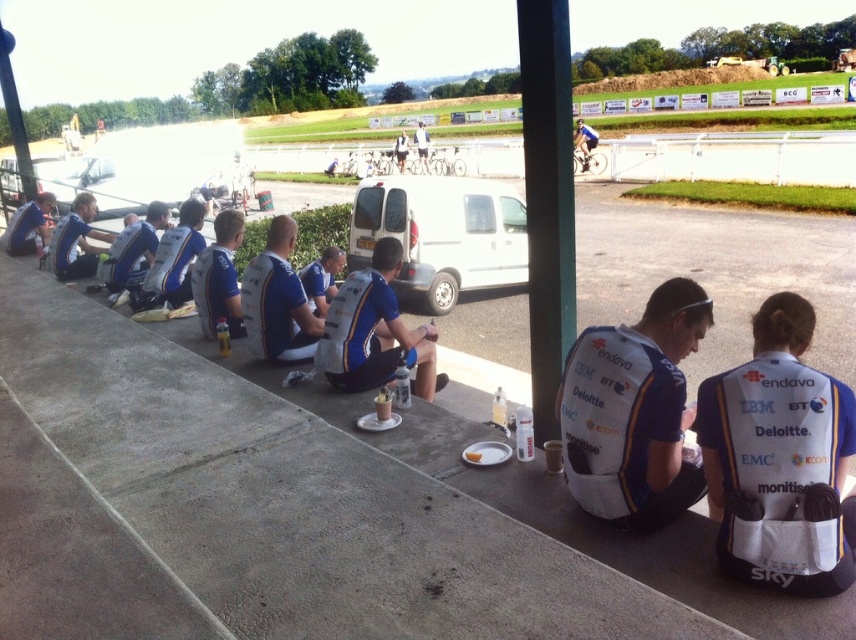
You are a photographer positioned at the center of the scene. You want to capture a photo that includes both the white fabric jersey at center and the matte blue jersey at left. What is the minimum distance you need to move backward to ensure both are in frame?

The minimum distance to move backward is 21.63 feet to include both the white fabric jersey at center and the matte blue jersey at left in the frame.

You are a photographer at the event and need to capture a photo of the matte blue jersey at left and the white fabric jacket at center. The camera frame can only accommodate one of them fully. Which one should you focus on to ensure it fits without cropping?

The matte blue jersey at left is wider than the white fabric jacket at center, so focusing on the matte blue jersey at left would ensure it fits without cropping.

You are a photographer at the event and need to arrange the cyclists for a group photo. The director wants the white fabric jersey at center to be positioned to the right of the matte blue jersey at left. Based on the current arrangement, is this requirement already satisfied?

Yes, the requirement is already satisfied because the white fabric jersey at center is currently positioned to the right of the matte blue jersey at left.